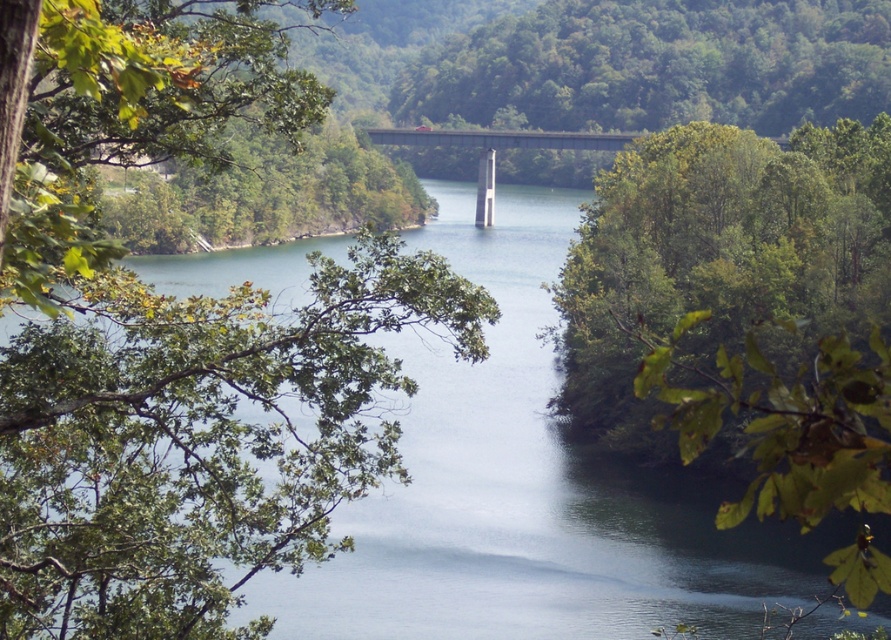
Does green leafy tree at center have a lesser width compared to green leafy trees at center?

Correct, green leafy tree at center's width is less than green leafy trees at center's.

Is green leafy tree at center below green leafy trees at center?

Yes.

Between point (744, 157) and point (413, 108), which one is positioned in front?

Positioned in front is point (744, 157).

Find the location of a particular element. The width and height of the screenshot is (891, 640). green leafy tree at center is located at coordinates (737, 308).

Is green leafy tree at center smaller than concrete bridge at center?

Incorrect, green leafy tree at center is not smaller in size than concrete bridge at center.

Measure the distance between green leafy tree at center and camera.

The distance of green leafy tree at center from camera is 119.48 feet.

You are a GUI agent. You are given a task and a screenshot of the screen. Output one action in this format:
    pyautogui.click(x=<x>, y=<y>)
    Task: Click on the green leafy tree at center
    The height and width of the screenshot is (640, 891).
    Given the screenshot: What is the action you would take?
    pyautogui.click(x=737, y=308)

Does green leafy tree at left appear over green leafy tree at center?

Yes.

Which is behind, point (267, 48) or point (857, 189)?

Positioned behind is point (857, 189).

This screenshot has width=891, height=640. Describe the element at coordinates (174, 340) in the screenshot. I see `green leafy tree at left` at that location.

In order to click on green leafy tree at left in this screenshot , I will do `click(174, 340)`.